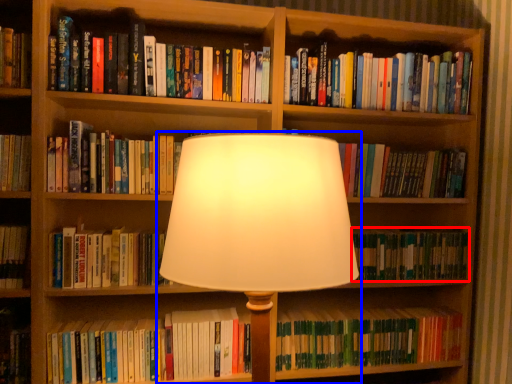
Question: Which object appears closest to the camera in this image, book (highlighted by a red box) or lamp (highlighted by a blue box)?

Choices:
 (A) book
 (B) lamp

Answer: (B)